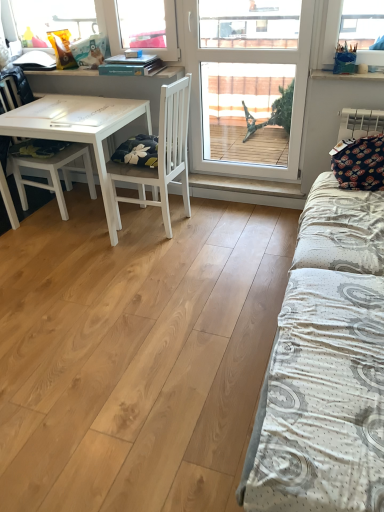
Locate an element on the screen. Image resolution: width=384 pixels, height=512 pixels. free point to the right of white matte chair at center, which ranks as the 2th chair in left-to-right order is located at coordinates (223, 220).